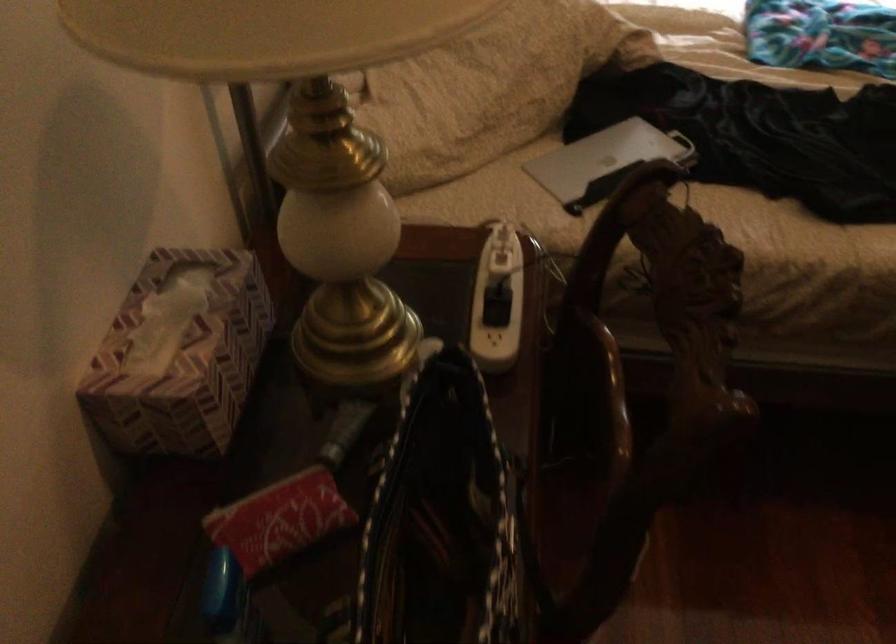
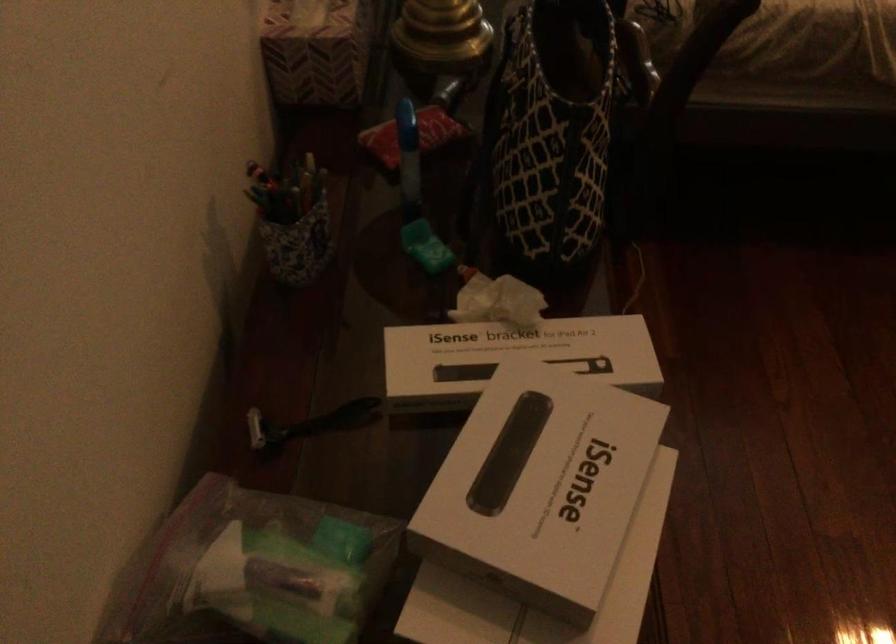
Question: The images are taken continuously from a first-person perspective. In which direction is your viewpoint rotating?

Choices:
 (A) Left
 (B) Right
 (C) Up
 (D) Down

Answer: (D)